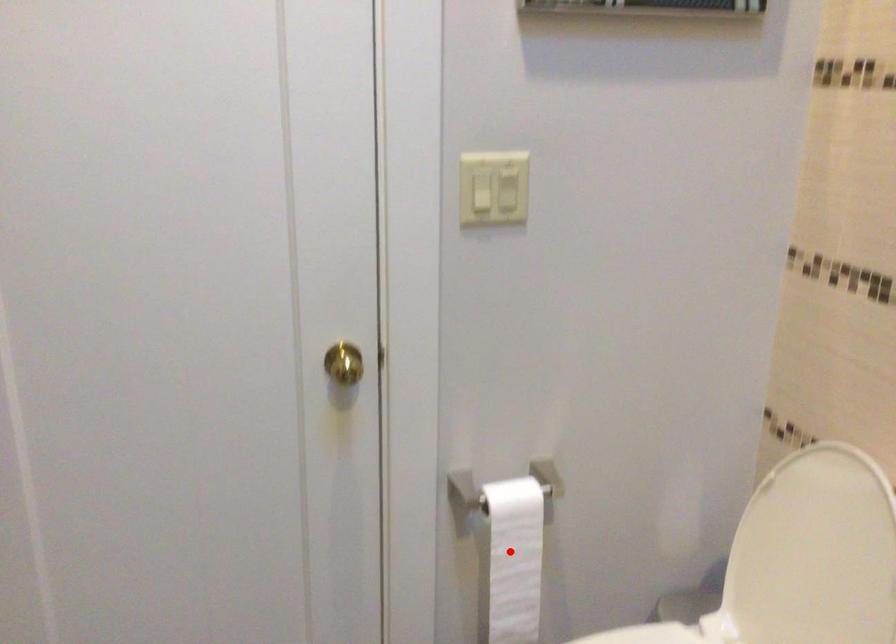
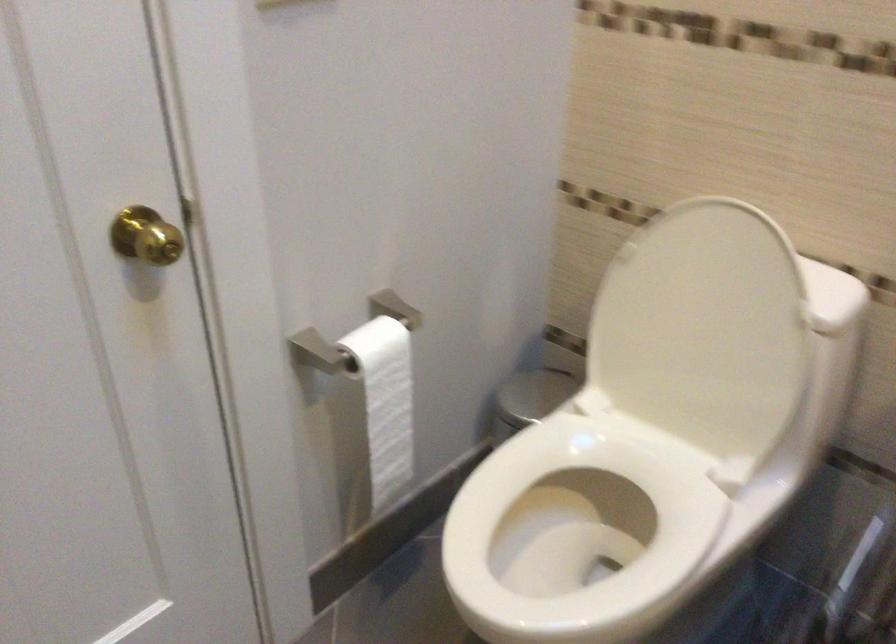
Question: I am providing you with two images of the same scene from different viewpoints. In image1, a red point is highlighted. Considering the same 3D point in image2, which of the following is correct?

Choices:
 (A) It is closer
 (B) It is farther

Answer: (A)